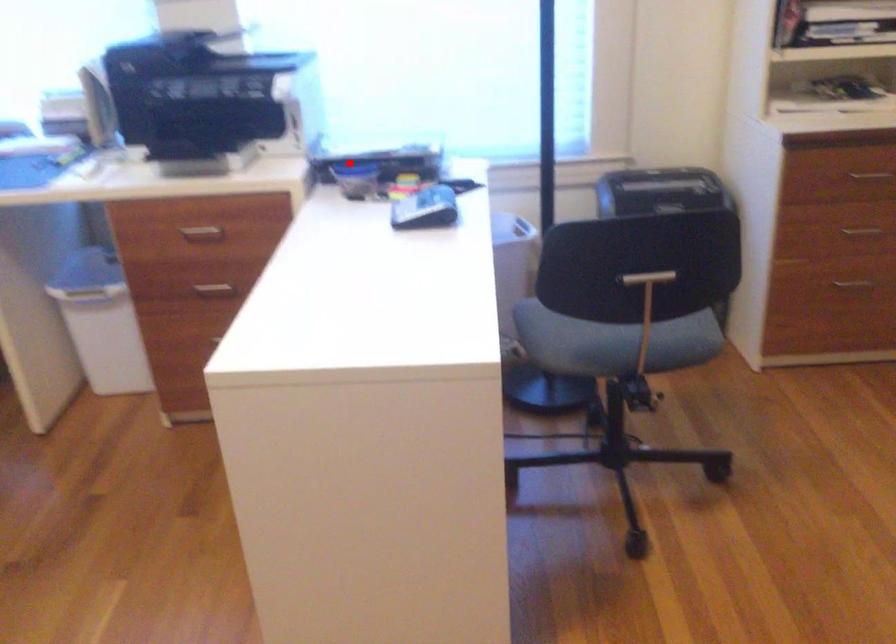
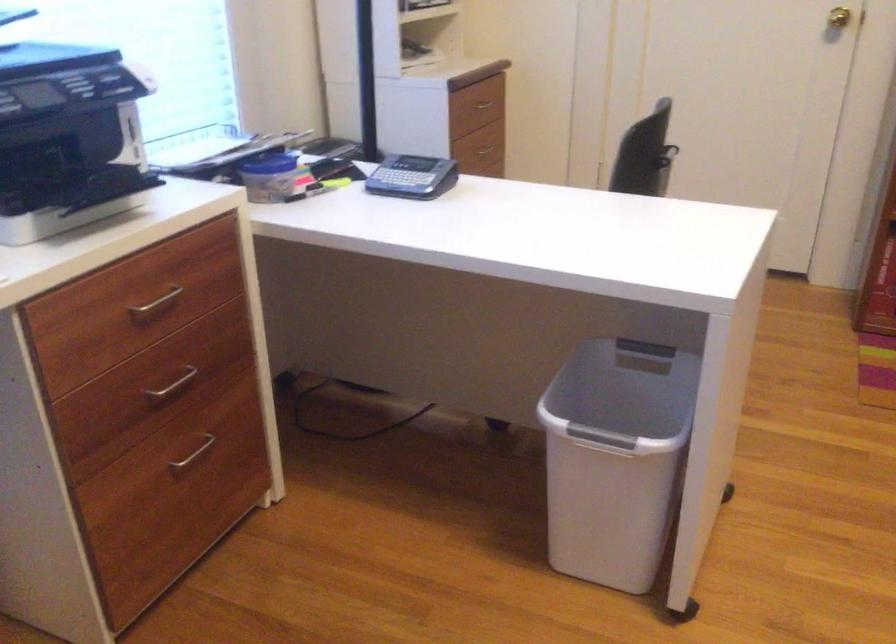
Find the pixel in the second image that matches the highlighted location in the first image.

(270, 164)